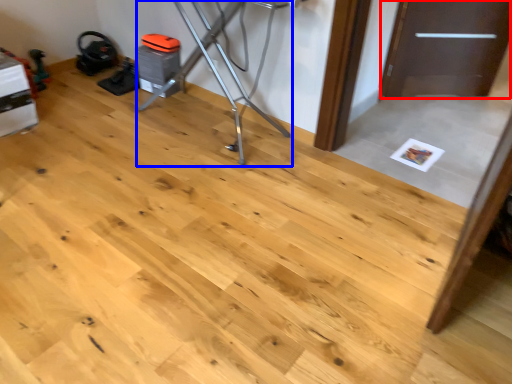
Question: Among these objects, which one is nearest to the camera, door (highlighted by a red box) or furniture (highlighted by a blue box)?

Choices:
 (A) door
 (B) furniture

Answer: (B)